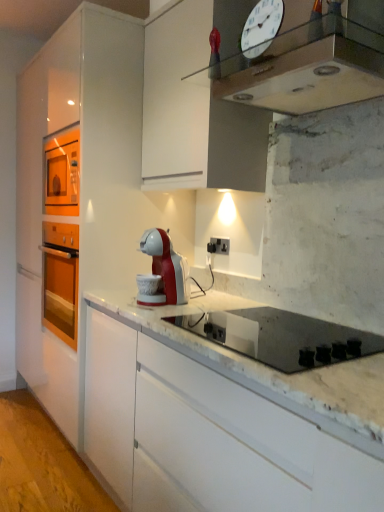
Find the location of `white glossy cabinet at center`. white glossy cabinet at center is located at coordinates (79, 189).

Describe the element at coordinates (261, 27) in the screenshot. I see `white glass clock at upper center` at that location.

The width and height of the screenshot is (384, 512). What do you see at coordinates (218, 246) in the screenshot?
I see `black plastic electric outlet at center` at bounding box center [218, 246].

What do you see at coordinates (42, 463) in the screenshot?
I see `white marble countertop at lower left` at bounding box center [42, 463].

This screenshot has width=384, height=512. In order to click on white glossy cabinet at center in this screenshot , I will do `click(79, 189)`.

Is there a large distance between black plastic electric outlet at center and white glass clock at upper center?

black plastic electric outlet at center is far away from white glass clock at upper center.

I want to click on clock on the right side of black plastic electric outlet at center, so click(261, 27).

From a real-world perspective, is black plastic electric outlet at center physically located above or below white glass clock at upper center?

From a real-world perspective, black plastic electric outlet at center is physically below white glass clock at upper center.

How different are the orientations of black plastic electric outlet at center and white glass clock at upper center in degrees?

The angular difference between black plastic electric outlet at center and white glass clock at upper center is 14.1 degrees.

How different are the orientations of white marble countertop at lower left and white glossy cabinet at center in degrees?

white marble countertop at lower left and white glossy cabinet at center are facing 89.6 degrees away from each other.

From a real-world perspective, is white marble countertop at lower left physically located above or below white glossy cabinet at center?

From a real-world perspective, white marble countertop at lower left is physically below white glossy cabinet at center.

Considering the relative positions of white marble countertop at lower left and white glossy cabinet at center in the image provided, is white marble countertop at lower left to the left or to the right of white glossy cabinet at center?

white marble countertop at lower left is to the left of white glossy cabinet at center.

Could you tell me if white marble countertop at lower left is turned towards white glossy cabinet at center?

No, white marble countertop at lower left does not turn towards white glossy cabinet at center.

Consider the image. How distant is metallic silver clock at upper center from black plastic electric outlet at center?

They are 35.11 inches apart.

From a real-world perspective, is metallic silver clock at upper center positioned above or below black plastic electric outlet at center?

metallic silver clock at upper center is above black plastic electric outlet at center.

Can you confirm if metallic silver clock at upper center is positioned to the left of black plastic electric outlet at center?

In fact, metallic silver clock at upper center is to the right of black plastic electric outlet at center.

Considering the relative sizes of black glass gas stove at center and white glossy cabinet at center in the image provided, is black glass gas stove at center shorter than white glossy cabinet at center?

Yes, black glass gas stove at center is shorter than white glossy cabinet at center.

Where is `gas stove in front of the white glossy cabinet at center`? Image resolution: width=384 pixels, height=512 pixels. gas stove in front of the white glossy cabinet at center is located at coordinates point(281,337).

Is black glass gas stove at center bigger than white glossy cabinet at center?

No.

From a real-world perspective, which is physically below, black plastic electric outlet at center or white marble countertop at lower left?

white marble countertop at lower left, from a real-world perspective.

Is white marble countertop at lower left located within black plastic electric outlet at center?

No, white marble countertop at lower left is not surrounded by black plastic electric outlet at center.

How distant is black plastic electric outlet at center from white marble countertop at lower left?

1.35 meters.

Looking at their sizes, would you say black plastic electric outlet at center is wider or thinner than white marble countertop at lower left?

Clearly, black plastic electric outlet at center has less width compared to white marble countertop at lower left.

Consider the image. Is metallic silver clock at upper center spatially inside white glossy cabinet at center, or outside of it?

metallic silver clock at upper center is not inside white glossy cabinet at center, it's outside.

Does metallic silver clock at upper center have a greater height compared to white glossy cabinet at center?

No, metallic silver clock at upper center is not taller than white glossy cabinet at center.

Image resolution: width=384 pixels, height=512 pixels. In order to click on home appliance above the white glossy cabinet at center (from the image's perspective) in this screenshot , I will do `click(303, 68)`.

From a real-world perspective, which is physically below, metallic silver clock at upper center or white glossy cabinet at center?

white glossy cabinet at center.

Does point (376, 67) come farther from viewer compared to point (31, 415)?

No, (376, 67) is in front of (31, 415).

Looking at the image, does metallic silver clock at upper center seem bigger or smaller compared to white marble countertop at lower left?

metallic silver clock at upper center is smaller than white marble countertop at lower left.

Which object is positioned more to the left, metallic silver clock at upper center or white marble countertop at lower left?

Positioned to the left is white marble countertop at lower left.

Is white marble countertop at lower left at the back of metallic silver clock at upper center?

No, white marble countertop at lower left is not at the back of metallic silver clock at upper center.

Find the location of a particular element. This screenshot has width=384, height=512. clock on the right of black plastic electric outlet at center is located at coordinates (261, 27).

I want to click on concrete beneath the white glossy cabinet at center (from a real-world perspective), so click(42, 463).

When comparing their distances from white glass clock at upper center, does black glass gas stove at center or white marble countertop at lower left seem closer?

black glass gas stove at center is closer to white glass clock at upper center.

Based on their spatial positions, is metallic silver clock at upper center or black glass gas stove at center closer to white glossy cabinet at center?

The object closer to white glossy cabinet at center is metallic silver clock at upper center.

Based on their spatial positions, is white glossy cabinet at center or white glass clock at upper center closer to metallic silver clock at upper center?

white glass clock at upper center is positioned closer to the anchor metallic silver clock at upper center.

Considering their positions, is black plastic electric outlet at center positioned closer to white marble countertop at lower left than white glossy cabinet at center?

white glossy cabinet at center is closer to white marble countertop at lower left.

Which object lies nearer to the anchor point black glass gas stove at center, metallic silver clock at upper center or black plastic electric outlet at center?

metallic silver clock at upper center is closer to black glass gas stove at center.

Estimate the real-world distances between objects in this image. Which object is closer to black plastic electric outlet at center, black glass gas stove at center or white glass clock at upper center?

black glass gas stove at center is positioned closer to the anchor black plastic electric outlet at center.

Looking at the image, which one is located closer to white marble countertop at lower left, black glass gas stove at center or white glossy cabinet at center?

Based on the image, white glossy cabinet at center appears to be nearer to white marble countertop at lower left.

Estimate the real-world distances between objects in this image. Which object is closer to white glass clock at upper center, white glossy cabinet at center or metallic silver clock at upper center?

Among the two, metallic silver clock at upper center is located nearer to white glass clock at upper center.

Locate an element on the screen. The image size is (384, 512). cabinetry between white glass clock at upper center and black plastic electric outlet at center along the z-axis is located at coordinates (79, 189).

You are a GUI agent. You are given a task and a screenshot of the screen. Output one action in this format:
    pyautogui.click(x=<x>, y=<y>)
    Task: Click on the cabinetry between white glass clock at upper center and white marble countertop at lower left from top to bottom
    Image resolution: width=384 pixels, height=512 pixels.
    Given the screenshot: What is the action you would take?
    pyautogui.click(x=79, y=189)

The height and width of the screenshot is (512, 384). Find the location of `clock between metallic silver clock at upper center and black plastic electric outlet at center in the front-back direction`. clock between metallic silver clock at upper center and black plastic electric outlet at center in the front-back direction is located at coordinates (261, 27).

You are a GUI agent. You are given a task and a screenshot of the screen. Output one action in this format:
    pyautogui.click(x=<x>, y=<y>)
    Task: Click on the gas stove between metallic silver clock at upper center and white marble countertop at lower left vertically
    This screenshot has width=384, height=512.
    Given the screenshot: What is the action you would take?
    pyautogui.click(x=281, y=337)